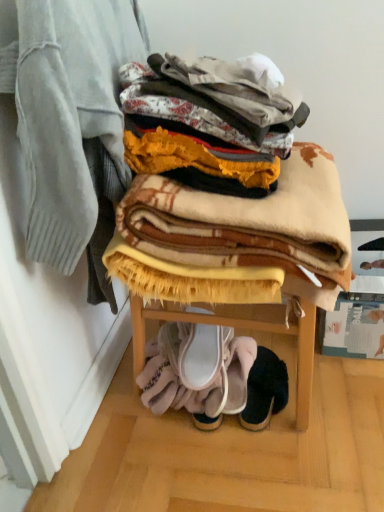
The width and height of the screenshot is (384, 512). In order to click on free space above white fabric slipper at lower center, positioned as the third footwear in right-to-left order (from a real-world perspective) in this screenshot , I will do `click(205, 344)`.